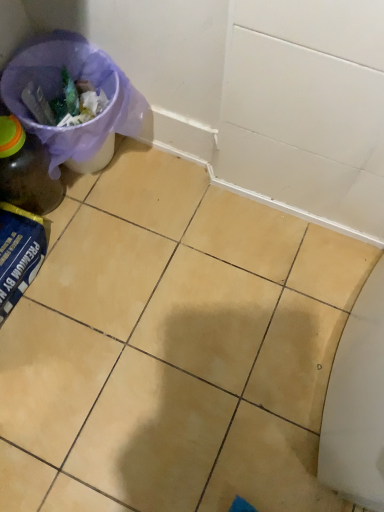
Question: From the image's perspective, is yellow matte tile at center beneath purple fabric bag at upper left?

Choices:
 (A) no
 (B) yes

Answer: (B)

Question: Considering the relative positions of yellow matte tile at center and purple fabric bag at upper left in the image provided, is yellow matte tile at center to the left of purple fabric bag at upper left from the viewer's perspective?

Choices:
 (A) yes
 (B) no

Answer: (B)

Question: Does yellow matte tile at center touch purple fabric bag at upper left?

Choices:
 (A) yes
 (B) no

Answer: (B)

Question: Considering the relative sizes of yellow matte tile at center and purple fabric bag at upper left in the image provided, is yellow matte tile at center shorter than purple fabric bag at upper left?

Choices:
 (A) no
 (B) yes

Answer: (B)

Question: Can you confirm if yellow matte tile at center is bigger than purple fabric bag at upper left?

Choices:
 (A) no
 (B) yes

Answer: (B)

Question: Is point (21, 143) closer or farther from the camera than point (278, 456)?

Choices:
 (A) closer
 (B) farther

Answer: (B)

Question: Is matte glass bottle at left taller or shorter than yellow matte tile at center?

Choices:
 (A) tall
 (B) short

Answer: (A)

Question: From a real-world perspective, relative to yellow matte tile at center, is matte glass bottle at left vertically above or below?

Choices:
 (A) below
 (B) above

Answer: (B)

Question: From the image's perspective, relative to yellow matte tile at center, is matte glass bottle at left above or below?

Choices:
 (A) above
 (B) below

Answer: (A)

Question: Is purple fabric bag at upper left to the left or to the right of matte glass bottle at left in the image?

Choices:
 (A) right
 (B) left

Answer: (A)

Question: Is purple fabric bag at upper left taller or shorter than matte glass bottle at left?

Choices:
 (A) tall
 (B) short

Answer: (A)

Question: Is purple fabric bag at upper left spatially inside matte glass bottle at left, or outside of it?

Choices:
 (A) outside
 (B) inside

Answer: (A)

Question: In the image, is purple fabric bag at upper left positioned in front of or behind matte glass bottle at left?

Choices:
 (A) front
 (B) behind

Answer: (B)

Question: Is point (0, 192) positioned closer to the camera than point (41, 64)?

Choices:
 (A) farther
 (B) closer

Answer: (B)

Question: Relative to purple fabric bag at upper left, is matte glass bottle at left in front or behind?

Choices:
 (A) front
 (B) behind

Answer: (A)